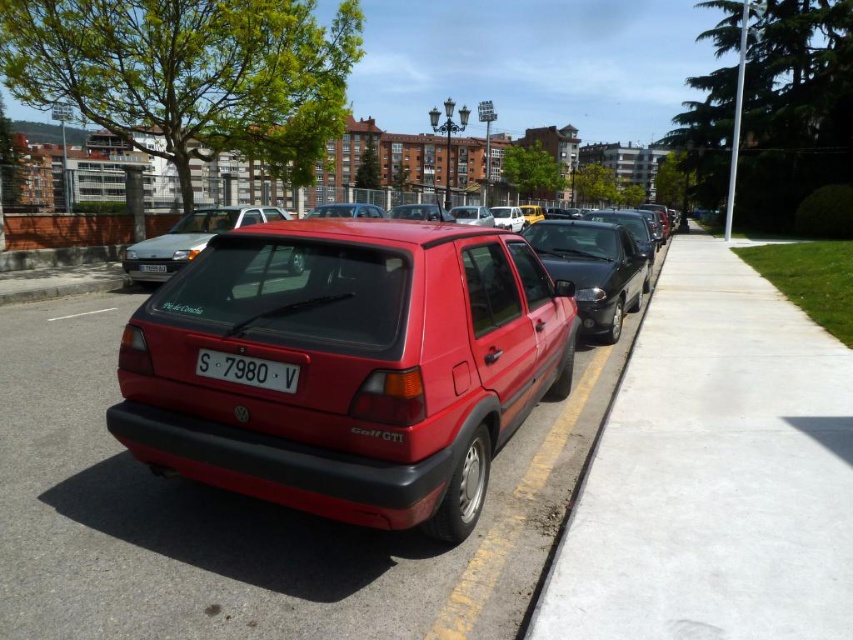
Question: Is white painted line at center to the left of white plastic license plate at rear from the viewer's perspective?

Choices:
 (A) yes
 (B) no

Answer: (A)

Question: Which point is closer to the camera?

Choices:
 (A) (47, 320)
 (B) (596, 528)

Answer: (B)

Question: Which object is farther from the camera taking this photo?

Choices:
 (A) smooth concrete pavement at center
 (B) concrete at center
 (C) white plastic license plate at center

Answer: (A)

Question: Estimate the real-world distances between objects in this image. Which object is farther from the glossy black sedan at center?

Choices:
 (A) satin silver hatchback at center
 (B) white plastic license plate at center

Answer: (A)

Question: Is white plastic license plate at center further to the viewer compared to white painted line at center?

Choices:
 (A) no
 (B) yes

Answer: (A)

Question: Is concrete at center closer to camera compared to glossy black sedan at center?

Choices:
 (A) no
 (B) yes

Answer: (B)